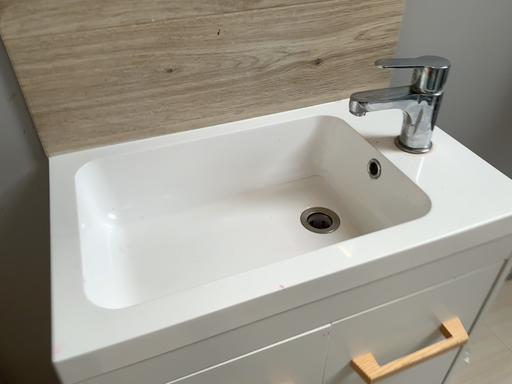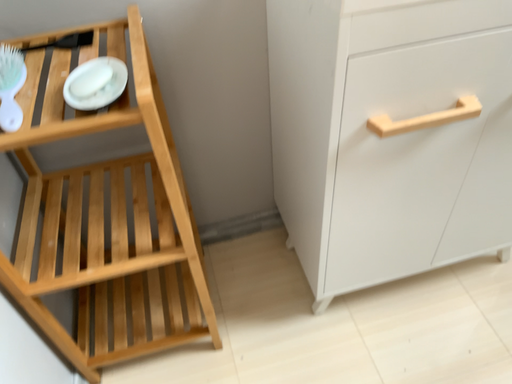
Question: How did the camera likely rotate when shooting the video?

Choices:
 (A) rotated right
 (B) rotated left

Answer: (B)